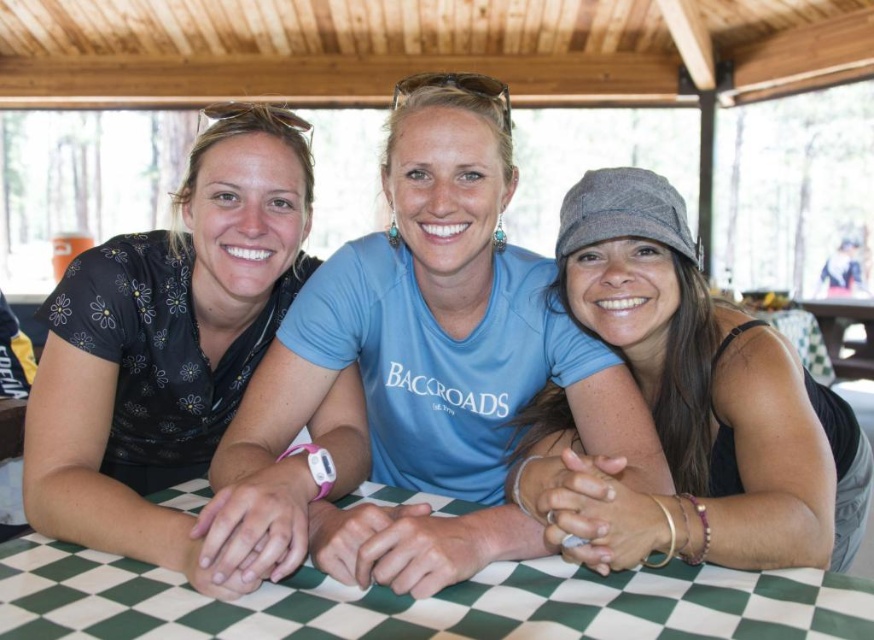
Question: Which object is positioned closest to the matte black shirt at center?

Choices:
 (A) green checkered table at center
 (B) black floral shirt at left
 (C) green checkered picnic table at center

Answer: (B)

Question: Is green checkered table at center behind green checkered picnic table at center?

Choices:
 (A) yes
 (B) no

Answer: (B)

Question: Which object is farther from the camera taking this photo?

Choices:
 (A) gray fabric cap at center
 (B) green checkered table at center

Answer: (A)

Question: Does matte black shirt at center have a smaller size compared to gray fabric cap at center?

Choices:
 (A) yes
 (B) no

Answer: (B)

Question: Does gray fabric cap at center have a lesser width compared to green checkered picnic table at center?

Choices:
 (A) yes
 (B) no

Answer: (B)

Question: Which of the following is the closest to the observer?

Choices:
 (A) (845, 324)
 (B) (461, 593)

Answer: (B)